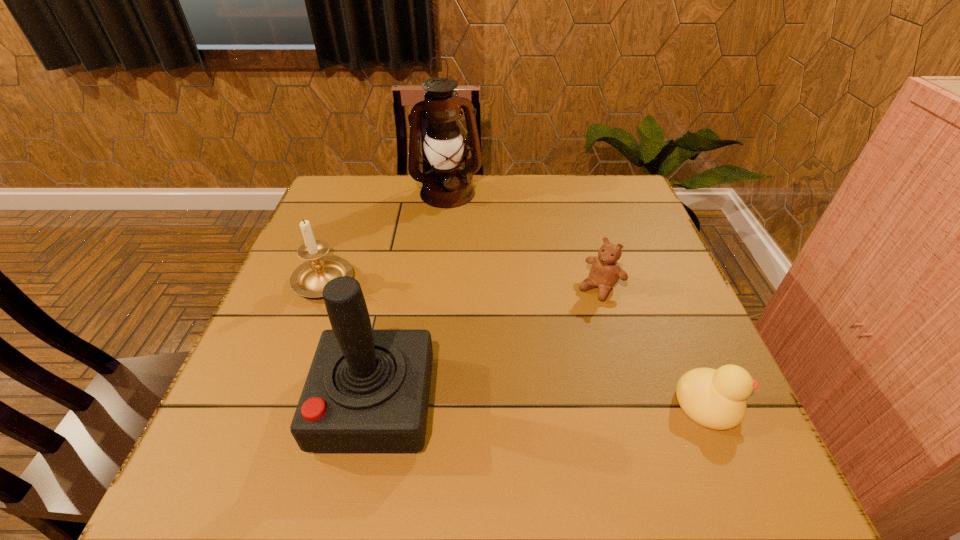
This screenshot has width=960, height=540. What are the coordinates of `joystick` in the screenshot? It's located at (367, 390).

The height and width of the screenshot is (540, 960). Identify the location of the shortest object. (715, 399).

Locate an element on the screen. Image resolution: width=960 pixels, height=540 pixels. the rightmost object is located at coordinates 715,399.

Locate an element on the screen. the tallest object is located at coordinates (446, 186).

Find the location of a particular element. This screenshot has height=540, width=960. lantern is located at coordinates (446, 186).

The image size is (960, 540). What are the coordinates of `teddy bear` in the screenshot? It's located at tap(605, 272).

Identify the location of the fourth tallest object. (605, 272).

Locate an element on the screen. the third shortest object is located at coordinates (308, 280).

Find the location of a particular element. This screenshot has height=540, width=960. vacant point located 0.160m on the base of the joystick is located at coordinates (233, 403).

The width and height of the screenshot is (960, 540). I want to click on free spot located 0.140m on the base of the joystick, so click(244, 403).